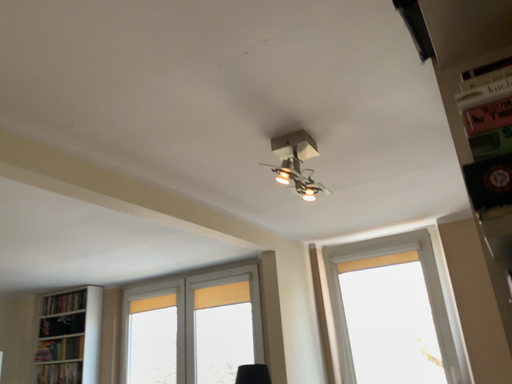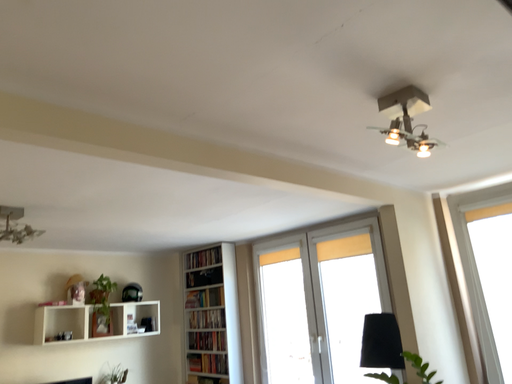
Question: How did the camera likely rotate when shooting the video?

Choices:
 (A) rotated right
 (B) rotated left

Answer: (B)